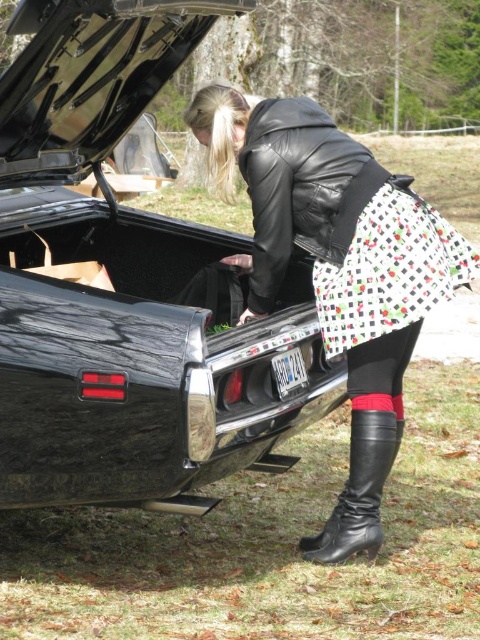
You are a fashion stylist observing a person dressed in a leather jacket at center and a black leather boot at lower center. Which item is covering part of the other?

The leather jacket at center is positioned over the black leather boot at lower center, so it is covering part of it.

You are standing in front of the glossy black car at center and the printed cotton skirt at center. Which object is nearer to your current position?

The glossy black car at center is closer to the viewer than the printed cotton skirt at center, so the glossy black car at center is nearer.